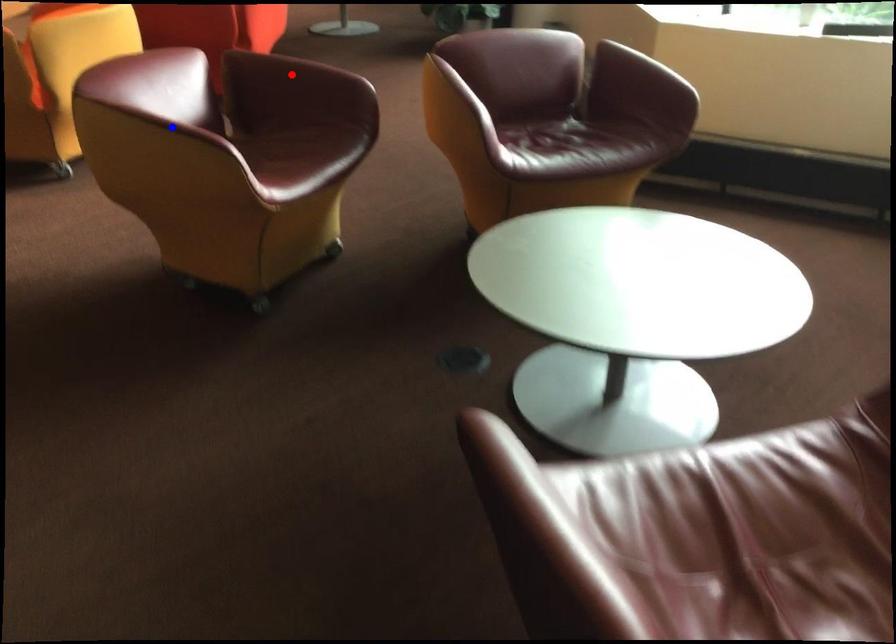
Question: Which of the two points in the image is closer to the camera?

Choices:
 (A) Blue point is closer.
 (B) Red point is closer.

Answer: (A)